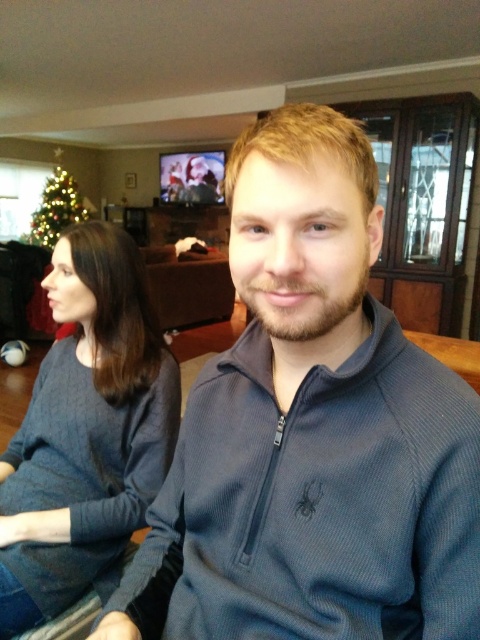
Question: Is dark gray sweater at left bigger than green matte christmas tree at left?

Choices:
 (A) yes
 (B) no

Answer: (B)

Question: Which object is positioned farthest from the dark gray sweater at left?

Choices:
 (A) dark blue zip-up sweater at center
 (B) green matte christmas tree at left

Answer: (B)

Question: Estimate the real-world distances between objects in this image. Which object is closer to the green matte christmas tree at left?

Choices:
 (A) dark blue zip-up sweater at center
 (B) dark gray sweater at left

Answer: (B)

Question: Which point is farther from the camera taking this photo?

Choices:
 (A) (354, 355)
 (B) (57, 205)

Answer: (B)

Question: Considering the relative positions of dark gray sweater at left and green matte christmas tree at left in the image provided, where is dark gray sweater at left located with respect to green matte christmas tree at left?

Choices:
 (A) right
 (B) left

Answer: (A)

Question: Is dark blue zip-up sweater at center positioned at the back of dark gray sweater at left?

Choices:
 (A) yes
 (B) no

Answer: (B)